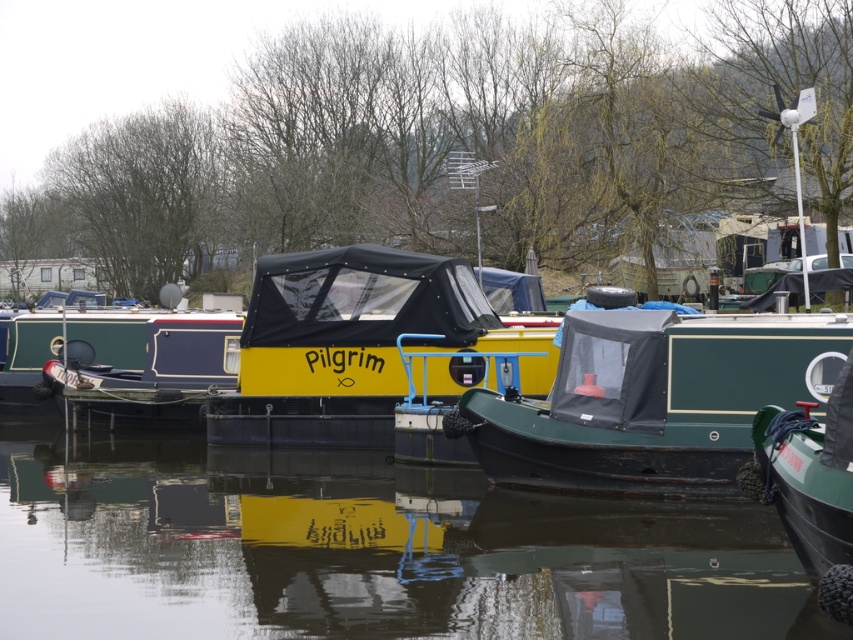
Is yellow matte boat at center thinner than green matte boat at right?

Incorrect, yellow matte boat at center's width is not less than green matte boat at right's.

Can you confirm if yellow matte boat at center is smaller than green matte boat at right?

No.

Describe the element at coordinates (352, 342) in the screenshot. I see `yellow matte boat at center` at that location.

At what (x,y) coordinates should I click in order to perform the action: click on yellow matte boat at center. Please return your answer as a coordinate pair (x, y). Image resolution: width=853 pixels, height=640 pixels. Looking at the image, I should click on (352, 342).

Is transparent water at center in front of green matte boat at right?

No, transparent water at center is behind green matte boat at right.

Who is more forward, (776, 577) or (845, 476)?

Point (845, 476) is in front.

At what (x,y) coordinates should I click in order to perform the action: click on transparent water at center. Please return your answer as a coordinate pair (x, y). The height and width of the screenshot is (640, 853). Looking at the image, I should click on (364, 552).

Locate an element on the screen. Image resolution: width=853 pixels, height=640 pixels. transparent water at center is located at coordinates click(x=364, y=552).

Can you confirm if green matte boat at center is taller than yellow matte boat at center?

In fact, green matte boat at center may be shorter than yellow matte boat at center.

Which is above, green matte boat at center or yellow matte boat at center?

Positioned higher is yellow matte boat at center.

Is point (750, 371) farther from viewer compared to point (425, 339)?

No, it is not.

Locate an element on the screen. The width and height of the screenshot is (853, 640). green matte boat at center is located at coordinates (650, 401).